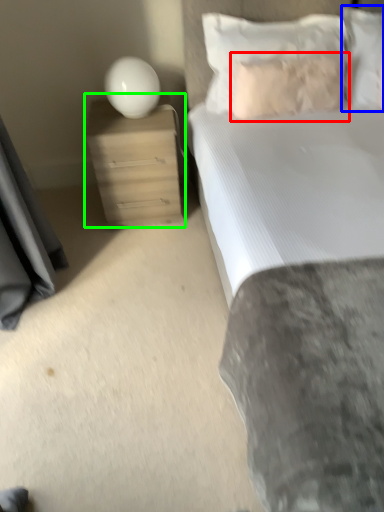
Question: Which object is positioned closest to pillow (highlighted by a red box)? Select from pillow (highlighted by a blue box) and nightstand (highlighted by a green box).

Choices:
 (A) pillow
 (B) nightstand

Answer: (A)